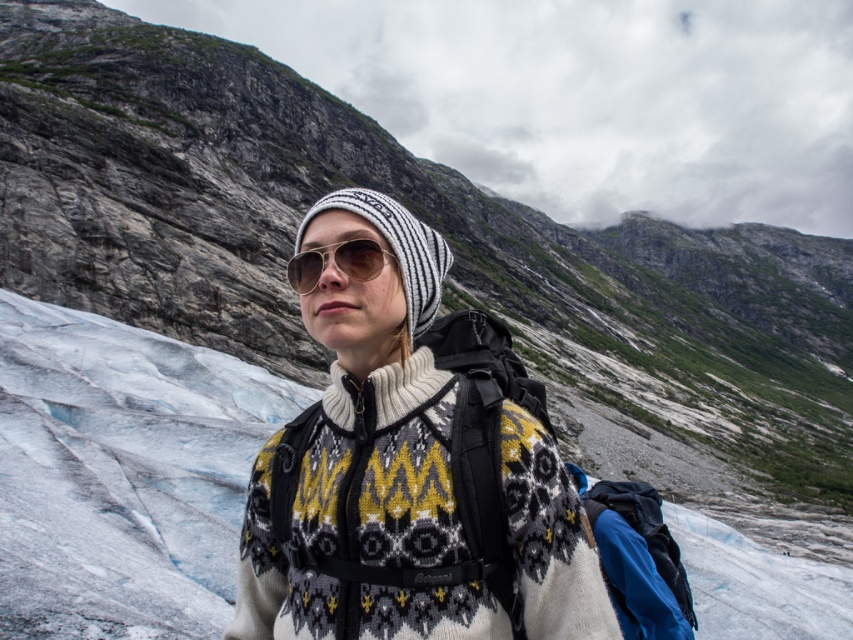
Which is more to the left, white knit beanie at center or brown reflective sunglasses at center?

Positioned to the left is brown reflective sunglasses at center.

The width and height of the screenshot is (853, 640). I want to click on white knit beanie at center, so click(396, 248).

At what (x,y) coordinates should I click in order to perform the action: click on white knit beanie at center. Please return your answer as a coordinate pair (x, y). This screenshot has height=640, width=853. Looking at the image, I should click on (396, 248).

Does white knitted sweater at center have a lesser width compared to white knit beanie at center?

In fact, white knitted sweater at center might be wider than white knit beanie at center.

Does white knitted sweater at center lie in front of white knit beanie at center?

Yes, white knitted sweater at center is closer to the viewer.

This screenshot has width=853, height=640. I want to click on white knitted sweater at center, so click(409, 472).

Does white knitted sweater at center have a greater height compared to brown reflective sunglasses at center?

Correct, white knitted sweater at center is much taller as brown reflective sunglasses at center.

The height and width of the screenshot is (640, 853). What do you see at coordinates (409, 472) in the screenshot?
I see `white knitted sweater at center` at bounding box center [409, 472].

At what (x,y) coordinates should I click in order to perform the action: click on white knitted sweater at center. Please return your answer as a coordinate pair (x, y). The width and height of the screenshot is (853, 640). Looking at the image, I should click on (409, 472).